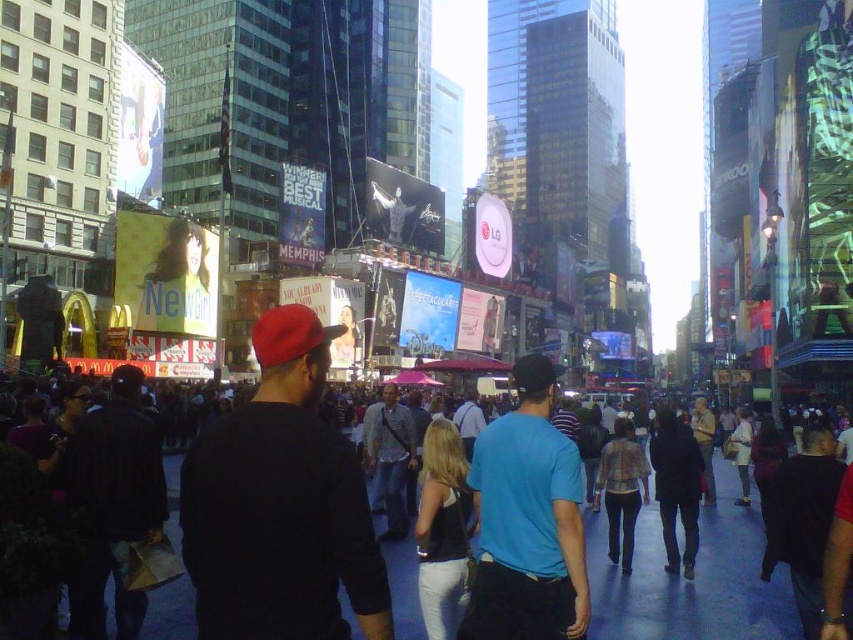
You are a photographer standing in Times Square and want to take a picture of the plaid shirt at center without including the black cotton crowd at center in the frame. Based on their positions, is this possible?

The black cotton crowd at center is to the left of the plaid shirt at center, so if you position yourself to the right side of the plaid shirt at center, you can frame the shot to exclude the black cotton crowd at center.

You are standing at the entrance of Times Square and see the plaid shirt at center and the metallic statue at center. If you want to reach both locations, which one is closer to you?

The plaid shirt at center is 49.39 meters away from the metallic statue at center, so the distance between them is 49.39 meters. However, since both are at the center, their distance from you at the entrance would depend on their positions relative to the entrance. The information provided does not specify their exact positions relative to the entrance, so I cannot determine which is closer.